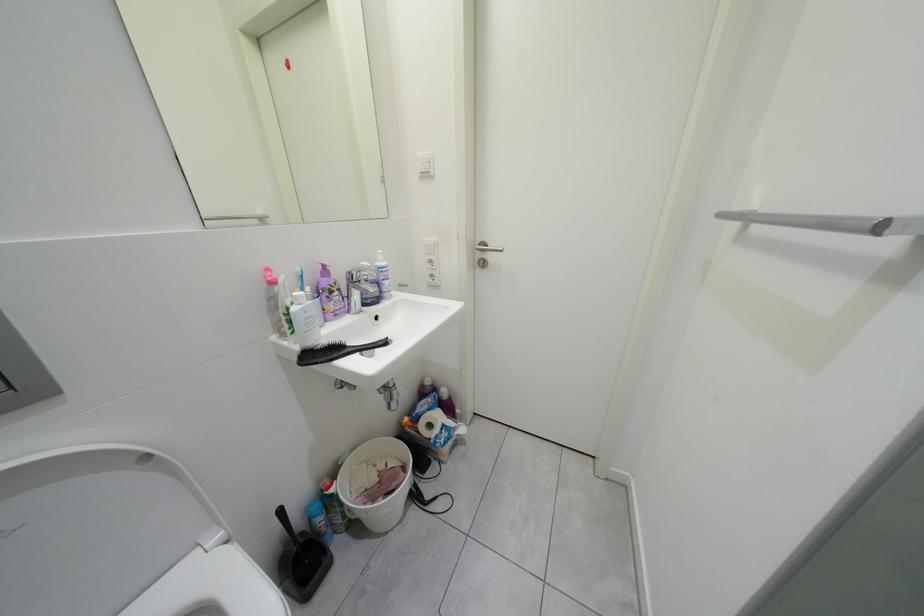
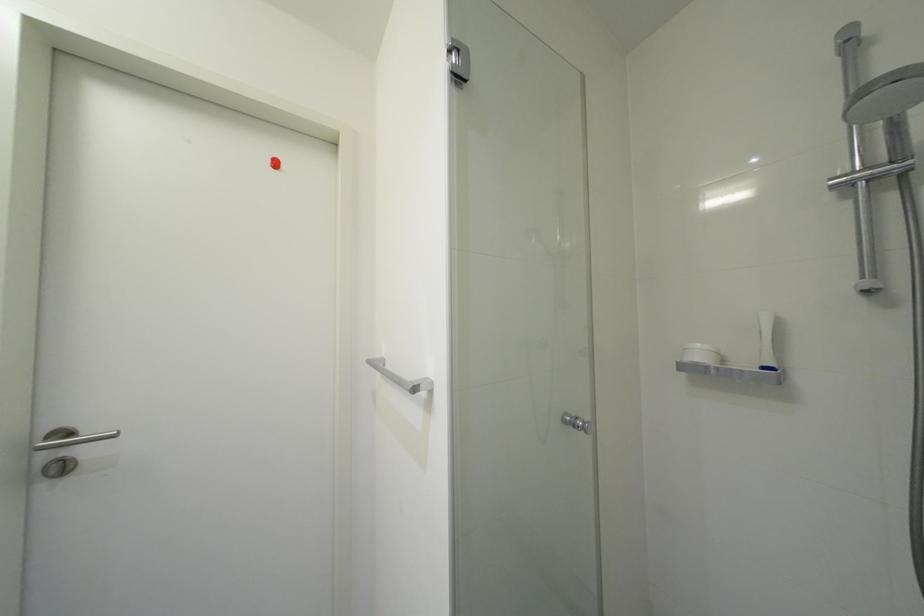
Question: The images are taken continuously from a first-person perspective. In which direction is your viewpoint rotating?

Choices:
 (A) Left
 (B) Right
 (C) Up
 (D) Down

Answer: (B)